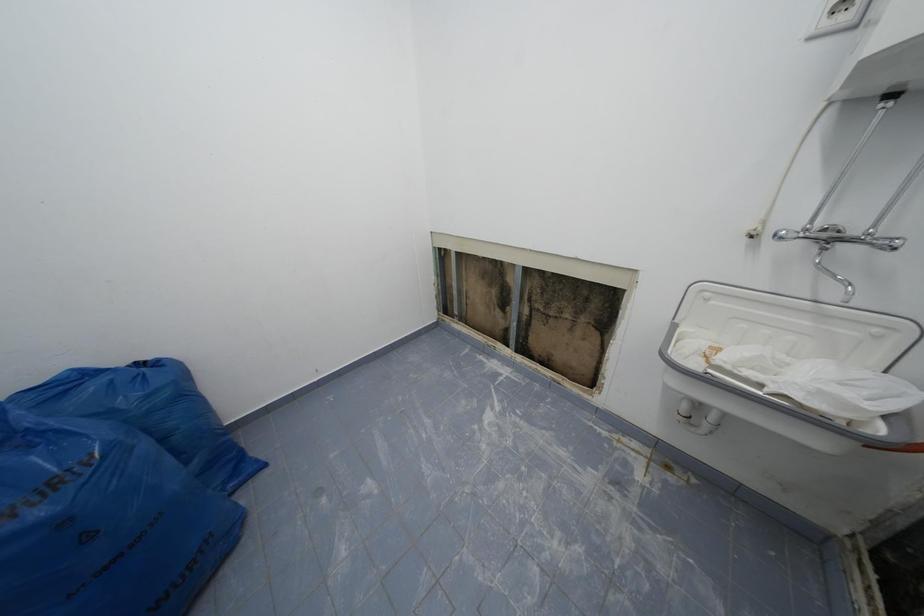
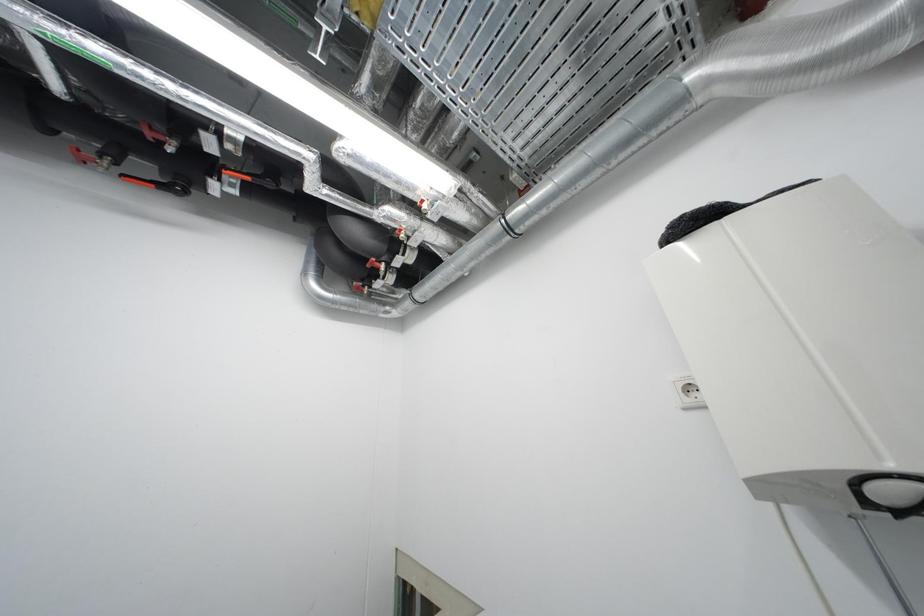
Question: How did the camera likely rotate?

Choices:
 (A) Left
 (B) Right
 (C) Up
 (D) Down

Answer: (C)